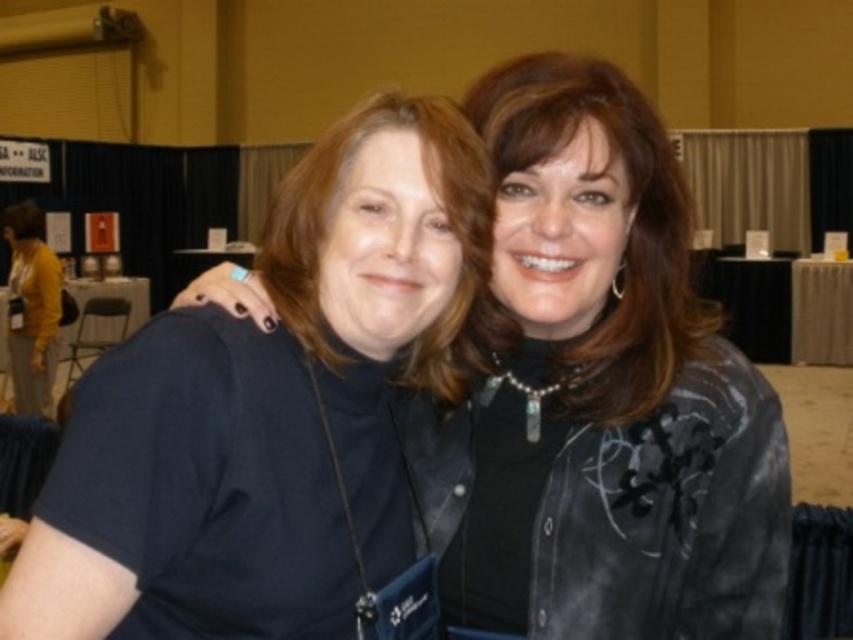
You are a photographer at a convention and need to ensure that two items, the matte black jacket at center and the black fabric shirt at center, can fit side by side on a 1.2 meter wide display stand. Based on their widths, will they both fit?

The matte black jacket at center has a lesser width compared to black fabric shirt at center. Since the total width of both items combined would be more than 1.2 meters, they might not fit side by side on the display stand.

You are organizing a clothing display and need to determine which item takes up more space. Based on the image, which item is larger between the matte black jacket at center and the black fabric shirt at center?

The matte black jacket at center is larger than the black fabric shirt at center according to the description.

You are a photographer at the event and want to take a closeup of the matte black jacket at center and black fabric shirt at center. Which one will appear larger in your photo?

The matte black jacket at center will appear larger in the photo because it is closer to the viewer than the black fabric shirt at center.